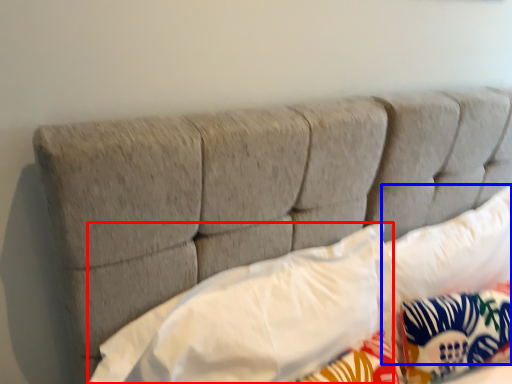
Question: Which point is further to the camera, pillow (highlighted by a red box) or pillow (highlighted by a blue box)?

Choices:
 (A) pillow
 (B) pillow

Answer: (B)